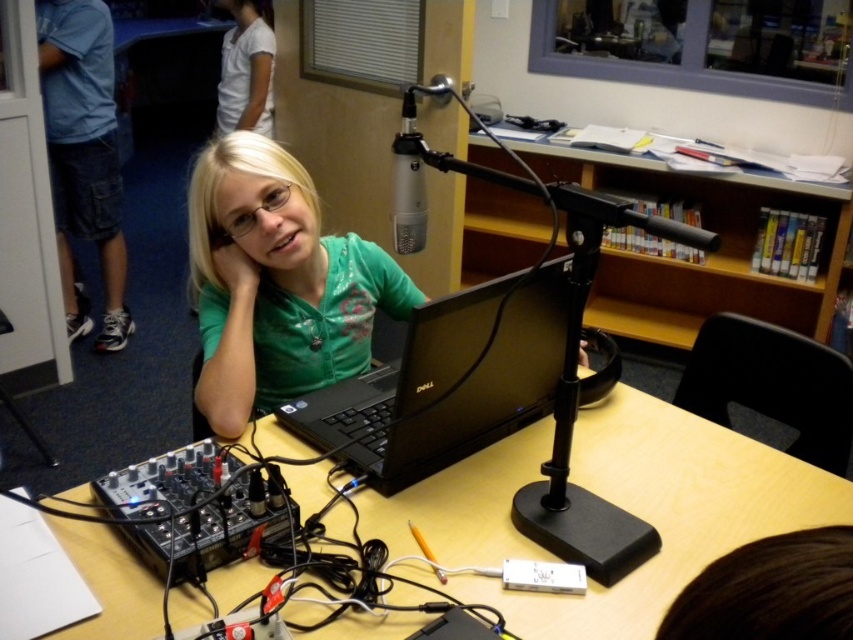
You are a technician adjusting the camera angle in the studio. You need to focus on either the point at [744,193] or the point at [228,88]. Which point should you adjust the focus to first if you want to focus on the closer one?

Point at [744,193] is closer to the camera than point at [228,88], so you should focus on point at [744,193] first.

In the radio studio scene, you notice two shirts visible in the image. The green matte shirt at center and the white cotton shirt at upper left. Which shirt is positioned to the right of the other?

The green matte shirt at center is positioned to the right of the white cotton shirt at upper left.

You are an interior designer planning to rearrange the studio. You need to know the relative positions of the wooden bookshelf at upper center and the white cotton shirt at upper left. Which object is positioned higher in the image?

The white cotton shirt at upper left is positioned higher in the image than the wooden bookshelf at upper center, which is located below it.